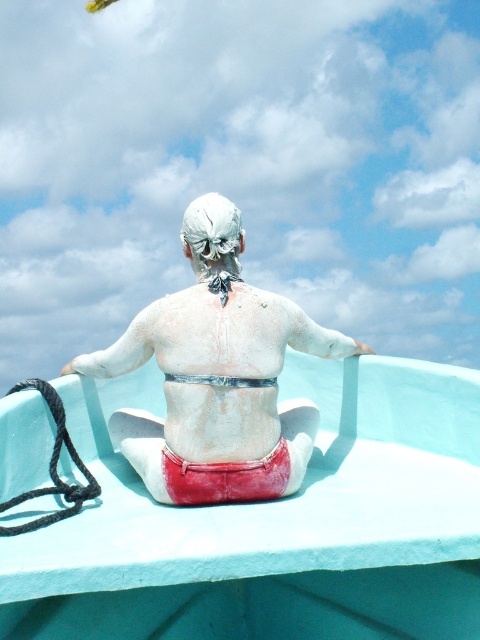
Question: Does teal plastic boat at center have a lesser width compared to white matte man at center?

Choices:
 (A) no
 (B) yes

Answer: (A)

Question: Which point is closer to the camera taking this photo?

Choices:
 (A) (235, 426)
 (B) (336, 528)

Answer: (B)

Question: Which object appears farthest from the camera in this image?

Choices:
 (A) teal plastic boat at center
 (B) white matte man at center

Answer: (B)

Question: Does teal plastic boat at center appear under white matte man at center?

Choices:
 (A) yes
 (B) no

Answer: (A)

Question: Which point appears closest to the camera in this image?

Choices:
 (A) (87, 586)
 (B) (120, 448)

Answer: (A)

Question: Where is teal plastic boat at center located in relation to white matte man at center in the image?

Choices:
 (A) left
 (B) right

Answer: (B)